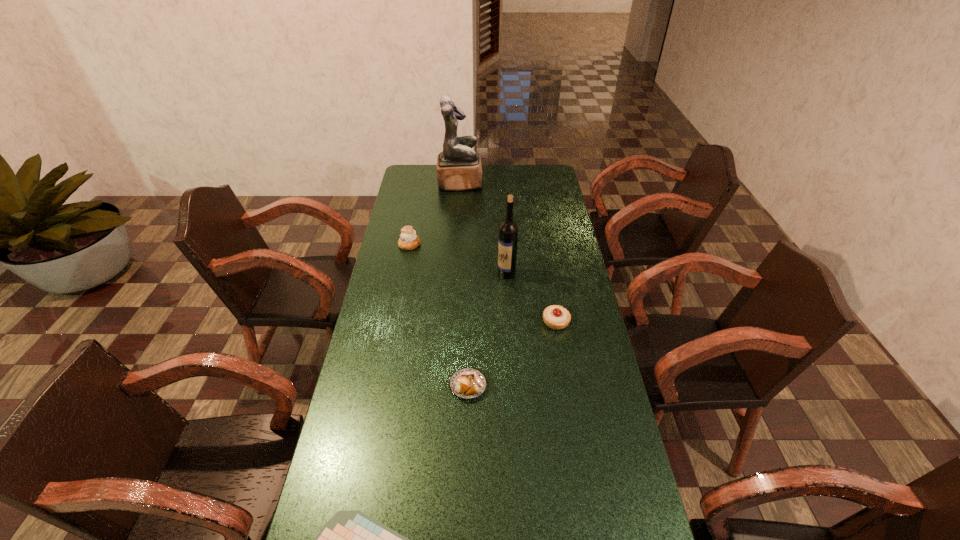
In the image, there is a desktop. At what (x,y) coordinates should I click in order to perform the action: click on free space at the left edge. Please return your answer as a coordinate pair (x, y). Image resolution: width=960 pixels, height=540 pixels. Looking at the image, I should click on (419, 198).

In the image, there is a desktop. In order to click on vacant space at the right edge in this screenshot , I will do pos(579,434).

At what (x,y) coordinates should I click in order to perform the action: click on free space at the far left corner of the desktop. Please return your answer as a coordinate pair (x, y). Looking at the image, I should click on (411, 167).

Find the location of `free area in between the fourth nearest object and the farthest object`. free area in between the fourth nearest object and the farthest object is located at coordinates (483, 228).

I want to click on free space between the tallest object and the second object from right to left, so click(x=483, y=228).

Find the location of a particular element. This screenshot has height=540, width=960. vacant space in between the shortest pastry and the tallest object is located at coordinates (464, 284).

Locate an element on the screen. The image size is (960, 540). blank region between the tallest object and the fourth shortest object is located at coordinates (435, 213).

You are a GUI agent. You are given a task and a screenshot of the screen. Output one action in this format:
    pyautogui.click(x=<x>, y=<y>)
    Task: Click on the vacant space that's between the fourth tallest object and the tallest pastry
    This screenshot has width=960, height=540.
    Given the screenshot: What is the action you would take?
    pyautogui.click(x=483, y=283)

Where is `vacant area that lies between the rightmost pastry and the nearest pastry`? This screenshot has width=960, height=540. vacant area that lies between the rightmost pastry and the nearest pastry is located at coordinates click(x=512, y=354).

Locate an element on the screen. This screenshot has height=540, width=960. empty space that is in between the sculpture and the fifth nearest object is located at coordinates (435, 213).